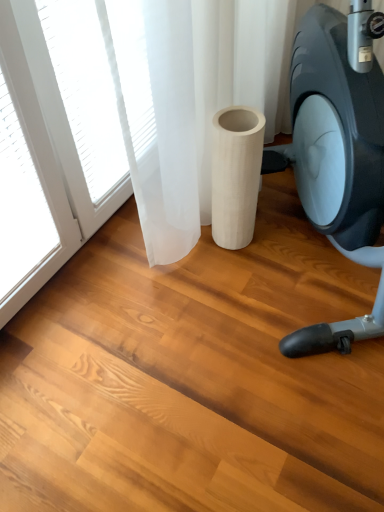
Question: Is matte black stationary bicycle at right far from white wood cylinder at center?

Choices:
 (A) no
 (B) yes

Answer: (A)

Question: Could you tell me if matte black stationary bicycle at right is turned towards white wood cylinder at center?

Choices:
 (A) yes
 (B) no

Answer: (B)

Question: Is matte black stationary bicycle at right to the left of white wood cylinder at center from the viewer's perspective?

Choices:
 (A) yes
 (B) no

Answer: (B)

Question: From a real-world perspective, is matte black stationary bicycle at right over white wood cylinder at center?

Choices:
 (A) no
 (B) yes

Answer: (B)

Question: From the image's perspective, would you say matte black stationary bicycle at right is positioned over white wood cylinder at center?

Choices:
 (A) no
 (B) yes

Answer: (B)

Question: Does matte black stationary bicycle at right have a greater width compared to white wood cylinder at center?

Choices:
 (A) yes
 (B) no

Answer: (A)

Question: Are white wood cylinder at center and matte black stationary bicycle at right making contact?

Choices:
 (A) yes
 (B) no

Answer: (B)

Question: From a real-world perspective, is white wood cylinder at center positioned under matte black stationary bicycle at right based on gravity?

Choices:
 (A) no
 (B) yes

Answer: (B)

Question: Is white wood cylinder at center far away from matte black stationary bicycle at right?

Choices:
 (A) no
 (B) yes

Answer: (A)

Question: Is the depth of white wood cylinder at center greater than that of matte black stationary bicycle at right?

Choices:
 (A) no
 (B) yes

Answer: (B)

Question: Is white wood cylinder at center completely or partially outside of matte black stationary bicycle at right?

Choices:
 (A) yes
 (B) no

Answer: (B)

Question: Does white wood cylinder at center have a lesser height compared to matte black stationary bicycle at right?

Choices:
 (A) yes
 (B) no

Answer: (A)

Question: In terms of size, does white wood cylinder at center appear bigger or smaller than matte black stationary bicycle at right?

Choices:
 (A) small
 (B) big

Answer: (A)